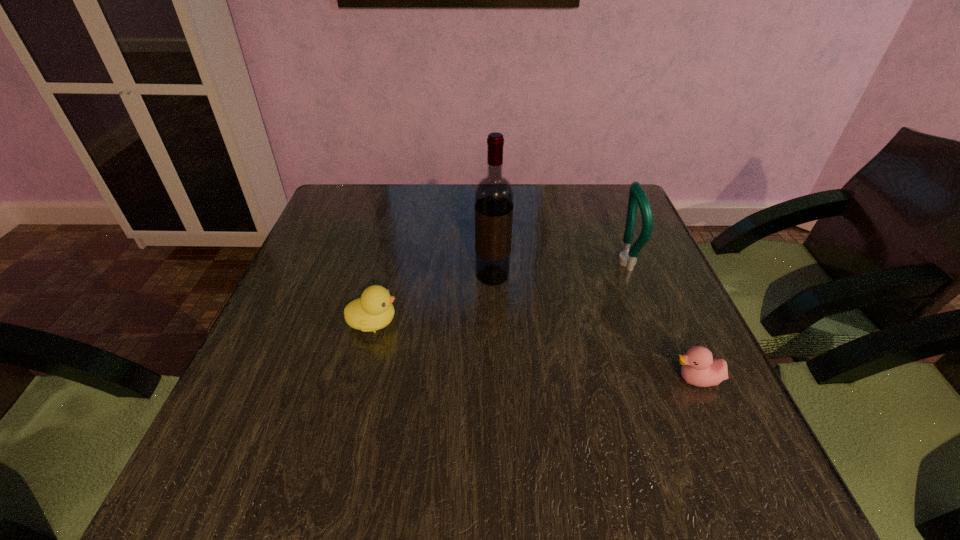
Identify the location of wine bottle. The image size is (960, 540). (494, 196).

Locate an element on the screen. the third object from right to left is located at coordinates (494, 196).

I want to click on the third shortest object, so click(637, 197).

Where is `the farther duckling`? Image resolution: width=960 pixels, height=540 pixels. the farther duckling is located at coordinates (373, 311).

This screenshot has width=960, height=540. I want to click on the left duckling, so click(373, 311).

Where is `the shortest object`? This screenshot has height=540, width=960. the shortest object is located at coordinates (699, 368).

Locate an element on the screen. the shorter duckling is located at coordinates (699, 368).

Find the location of a particular element. vacant region located 0.150m on the right of the wine bottle is located at coordinates (574, 276).

This screenshot has width=960, height=540. Identify the location of free spot located 0.190m at the jaws of the bottle opener. click(x=534, y=262).

Where is `free space located at the jaws of the bottle opener`? free space located at the jaws of the bottle opener is located at coordinates (539, 262).